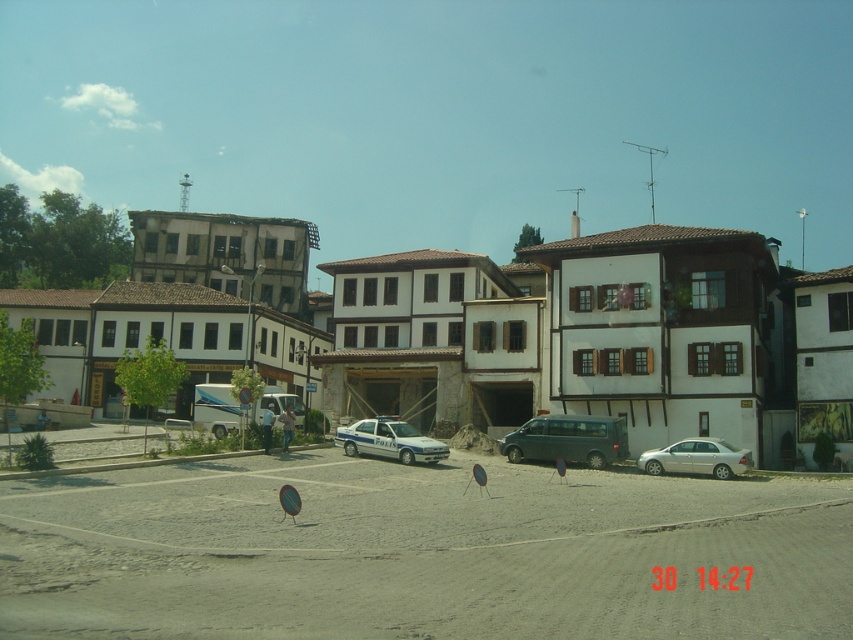
You are driving a delivery truck and need to pass through the street where the teal matte van at center and the white glossy police car at center are parked. Can you safely navigate around them without moving the vehicles?

The white glossy police car at center is behind the teal matte van at center, so you can safely navigate around the teal matte van at center as long as there is enough space on either side or in front of it. However, you should avoid obstructing the white glossy police car at center which is positioned behind.

You are standing at the entrance of the street and want to park your car in the smooth asphalt parking lot at center. Based on the coordinates provided, is the parking lot located closer to the north or south end of the street?

The smooth asphalt parking lot at center is located at coordinates point (x=419, y=552). Since the y coordinate is 0.492, which is closer to 0.5, the parking lot is at the center of the street, so it is equidistant from both the north and south ends.